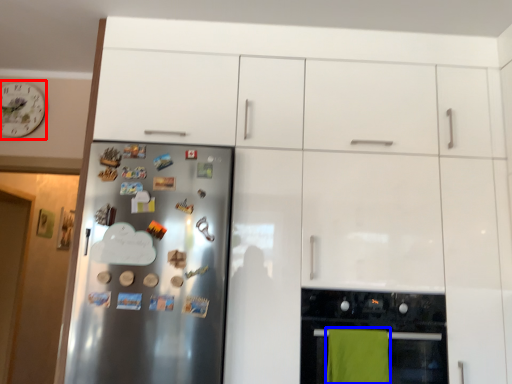
Question: Among these objects, which one is nearest to the camera, clock (highlighted by a red box) or beach towel (highlighted by a blue box)?

Choices:
 (A) clock
 (B) beach towel

Answer: (B)